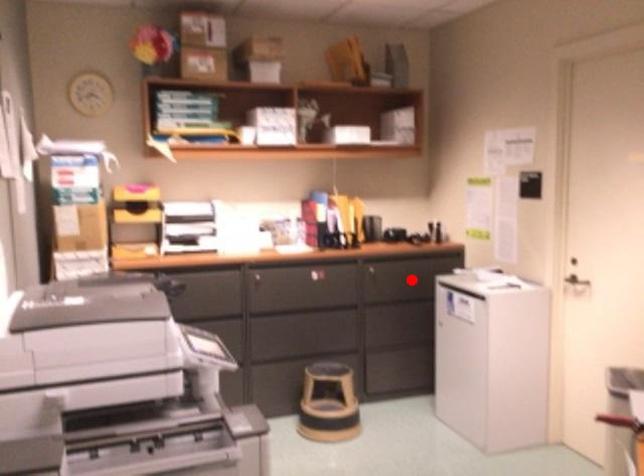
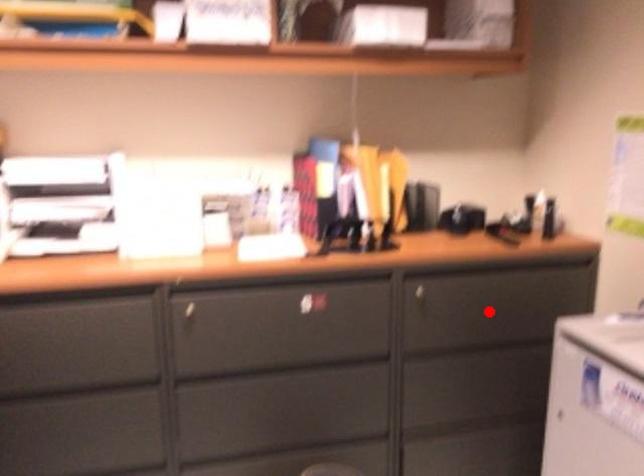
I am providing you with two images of the same scene from different viewpoints. A red point is marked on the first image and another point is marked on the second image. Do the highlighted points in image1 and image2 indicate the same real-world spot?

Yes